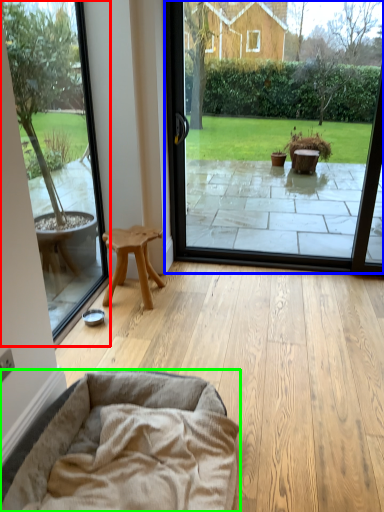
Question: Considering the real-world distances, which object is farthest from window screen (highlighted by a red box)? window screen (highlighted by a blue box) or dog bed (highlighted by a green box)?

Choices:
 (A) window screen
 (B) dog bed

Answer: (A)